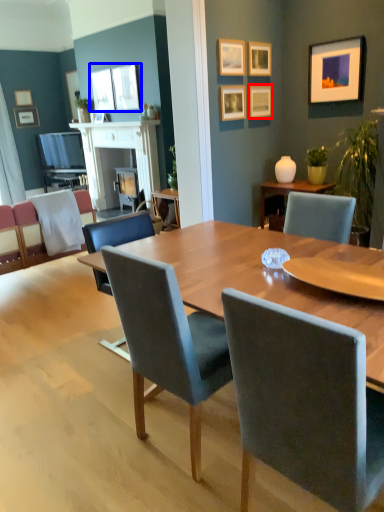
Question: Among these objects, which one is farthest to the camera, picture frame (highlighted by a red box) or picture frame (highlighted by a blue box)?

Choices:
 (A) picture frame
 (B) picture frame

Answer: (B)